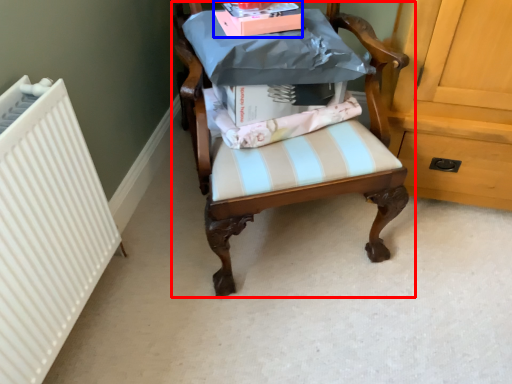
Question: Which object appears closest to the camera in this image, chair (highlighted by a red box) or book (highlighted by a blue box)?

Choices:
 (A) chair
 (B) book

Answer: (A)